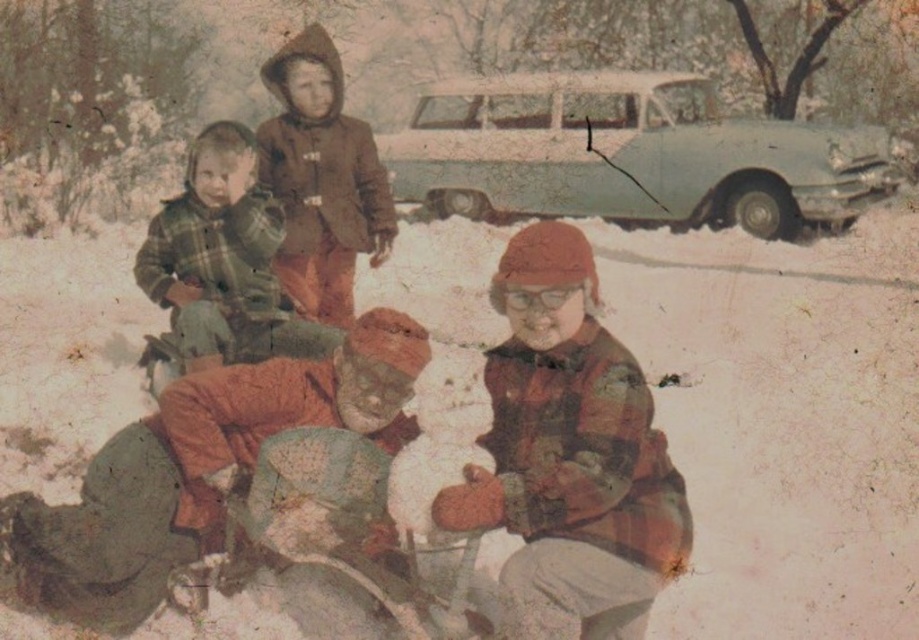
You are standing at the point with coordinates point [173,342] and want to walk to the point with coordinates point [848,163]. Is the destination point behind you or in front of you?

The destination point point [848,163] is behind point [173,342], so it is behind you.